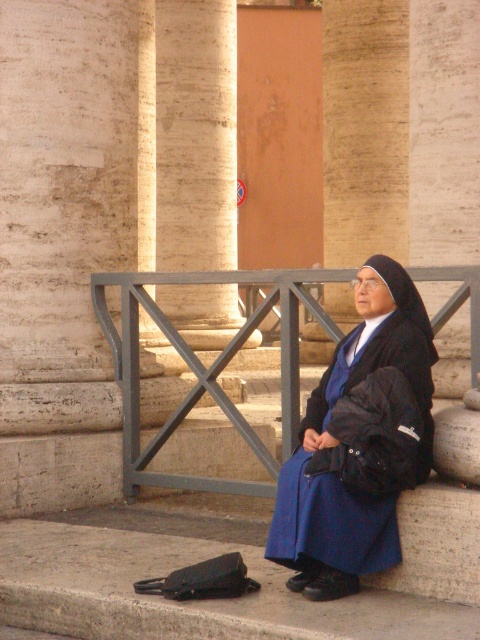
You are a visitor at a historical site and want to take a photo of the metallic gray rail at center. According to the coordinates provided, where should you position yourself to capture the rail in the center of your camera frame?

Position yourself directly in front of the metallic gray rail at center at coordinates point (208, 365) to ensure it is centered in your camera frame.

You are a visitor at a historical site and want to take a photo of the blue fabric nun at center without the metallic gray rail at center appearing in the frame. Is it possible to position yourself in a way that excludes the rail from the photo?

The metallic gray rail at center is larger in size than the blue fabric nun at center, so it might be challenging to exclude the rail entirely. However, by moving closer to the nun and zooming in, you can potentially frame the shot so that the blue fabric nun at center fills the frame while minimizing the rail visibility.

You are standing at the camera position and want to reach the point marked at coordinates point (213,104). If your walking speed is 3 feet per second, how many seconds will it take you to reach that point?

The point marked at coordinates point (213,104) is 149.79 feet away from the camera. At a walking speed of 3 feet per second, it would take approximately 49.93 seconds to reach that point.